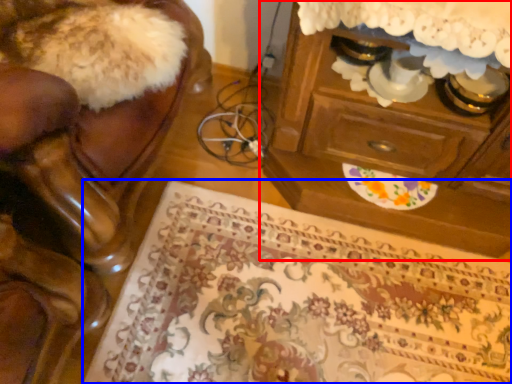
Question: Which of the following is the farthest to the observer, chest of drawers (highlighted by a red box) or mat (highlighted by a blue box)?

Choices:
 (A) chest of drawers
 (B) mat

Answer: (B)